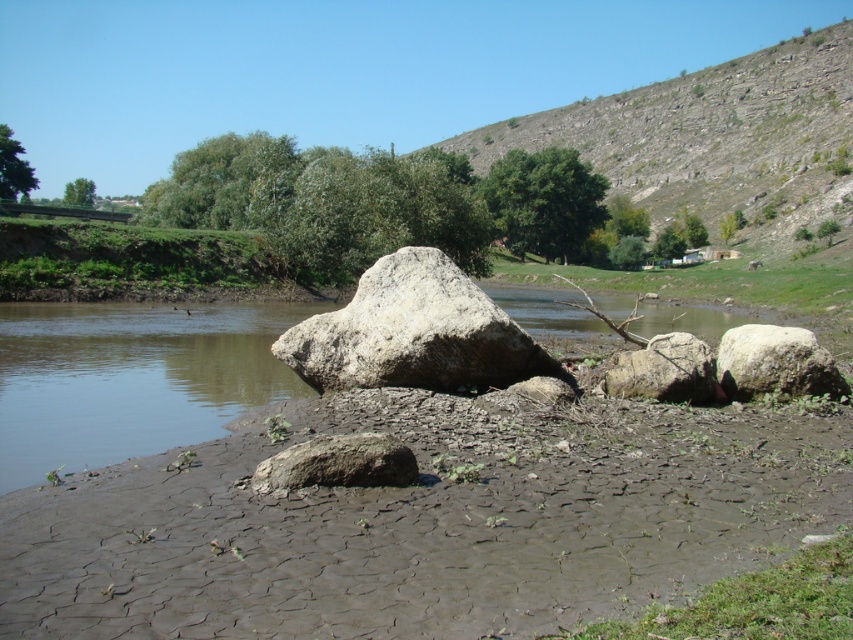
Question: Can you confirm if dull gray mud at lower center is positioned to the right of white rough rock at right?

Choices:
 (A) yes
 (B) no

Answer: (B)

Question: Which point is closer to the camera?

Choices:
 (A) white rough rock at right
 (B) white rough boulder at center
 (C) gray rough rock at lower center
 (D) smooth gray rock at center

Answer: (C)

Question: Which point is farther from the camera taking this photo?

Choices:
 (A) (666, 385)
 (B) (370, 317)
 (C) (299, 422)

Answer: (B)

Question: Does dull gray mud at lower center have a smaller size compared to white rough rock at right?

Choices:
 (A) no
 (B) yes

Answer: (B)

Question: Where is white rough rock at right located in relation to gray rough rock at lower center in the image?

Choices:
 (A) above
 (B) below

Answer: (A)

Question: Which point is farther to the camera?

Choices:
 (A) (630, 387)
 (B) (416, 624)

Answer: (A)